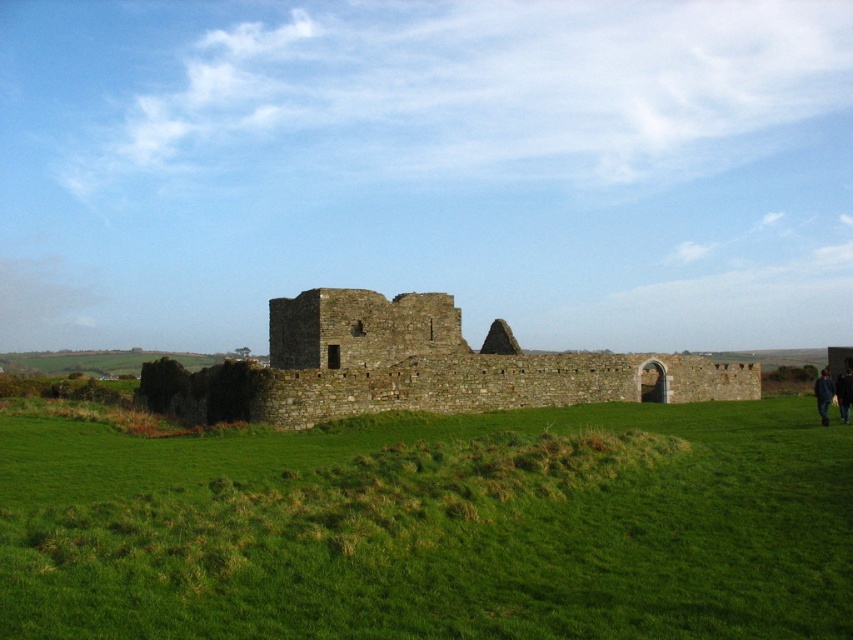
You are a photographer planning to take a photo of the brown stone ruins at center and the dark blue fabric at lower right. Which object is placed higher in the image?

The brown stone ruins at center is positioned over the dark blue fabric at lower right, meaning it is higher in the image.

You are a hiker standing at the base of the green grassy hill at center and want to reach the top of the brown stone ruins at center. Which path would require climbing a steeper incline?

The path to the brown stone ruins at center requires a steeper incline because the brown stone ruins at center are taller than the green grassy hill at center.